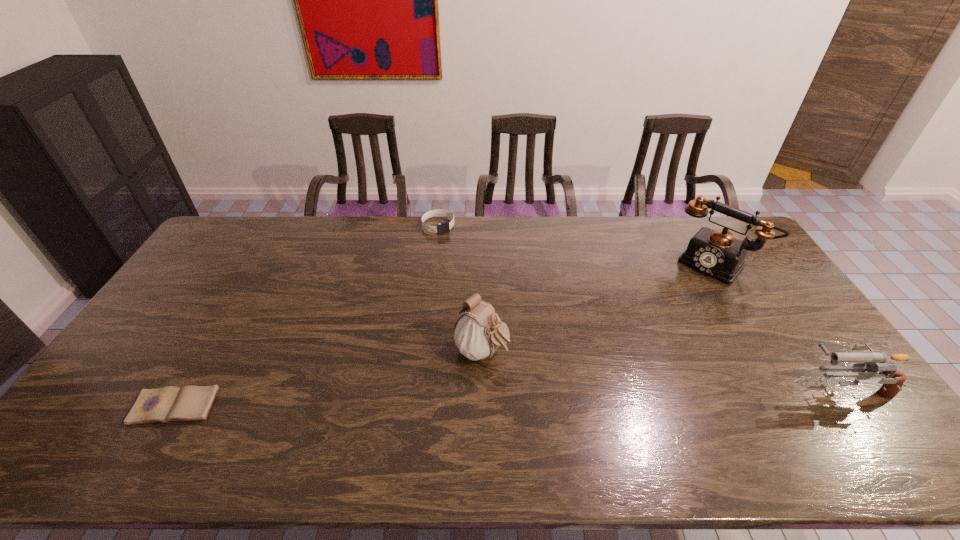
Image resolution: width=960 pixels, height=540 pixels. I want to click on the shortest object, so click(x=189, y=403).

Find the location of a particular element. This screenshot has width=960, height=540. diary is located at coordinates (189, 403).

Locate an element on the screen. The image size is (960, 540). the third shortest object is located at coordinates (872, 362).

Identify the location of the fourth nearest object. This screenshot has height=540, width=960. (716, 253).

You are a GUI agent. You are given a task and a screenshot of the screen. Output one action in this format:
    pyautogui.click(x=<x>, y=<y>)
    Task: Click on the tallest object
    Image resolution: width=960 pixels, height=540 pixels.
    Given the screenshot: What is the action you would take?
    pyautogui.click(x=716, y=253)

Locate an element on the screen. the third object from right to left is located at coordinates [x=478, y=332].

Locate an element on the screen. This screenshot has width=960, height=540. the second shortest object is located at coordinates (441, 228).

What are the coordinates of `the farthest object` in the screenshot? It's located at (441, 228).

The height and width of the screenshot is (540, 960). Find the location of `free location located 0.400m on the back of the leftmost object`. free location located 0.400m on the back of the leftmost object is located at coordinates (245, 285).

Where is `vacant area situated 0.260m at the barrel end of the third shortest object`? The image size is (960, 540). vacant area situated 0.260m at the barrel end of the third shortest object is located at coordinates (x=702, y=388).